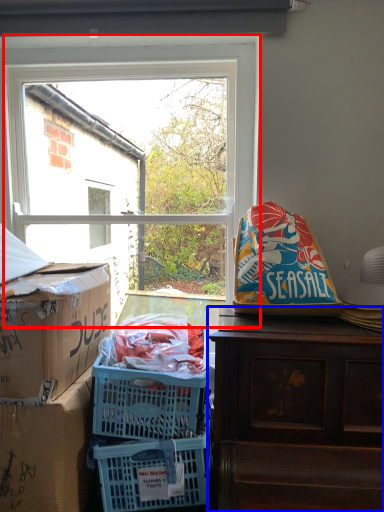
Question: Which object appears closest to the camera in this image, window (highlighted by a red box) or desk (highlighted by a blue box)?

Choices:
 (A) window
 (B) desk

Answer: (B)